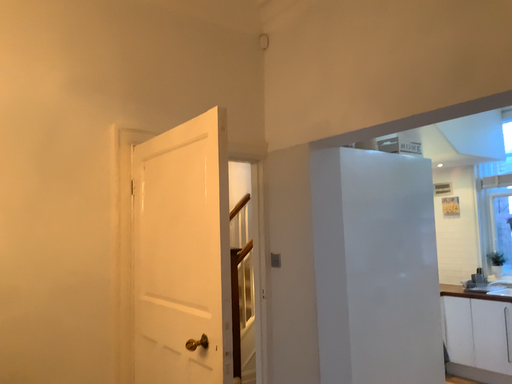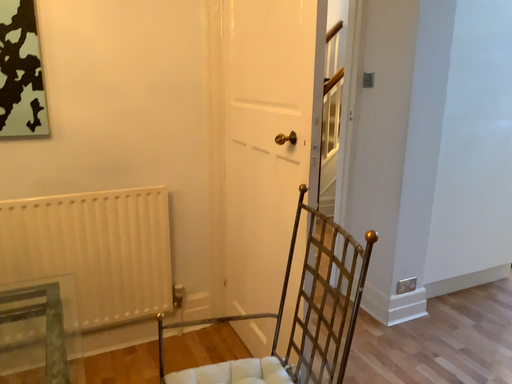
Question: Which way did the camera rotate in the video?

Choices:
 (A) rotated downward
 (B) rotated upward

Answer: (A)